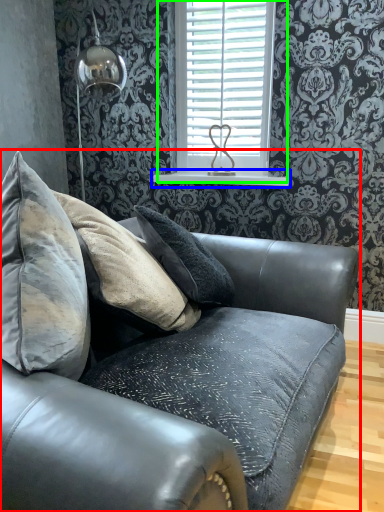
Question: Based on their relative distances, which object is farther from studio couch (highlighted by a red box)? Choose from window sill (highlighted by a blue box) and window (highlighted by a green box).

Choices:
 (A) window sill
 (B) window

Answer: (A)